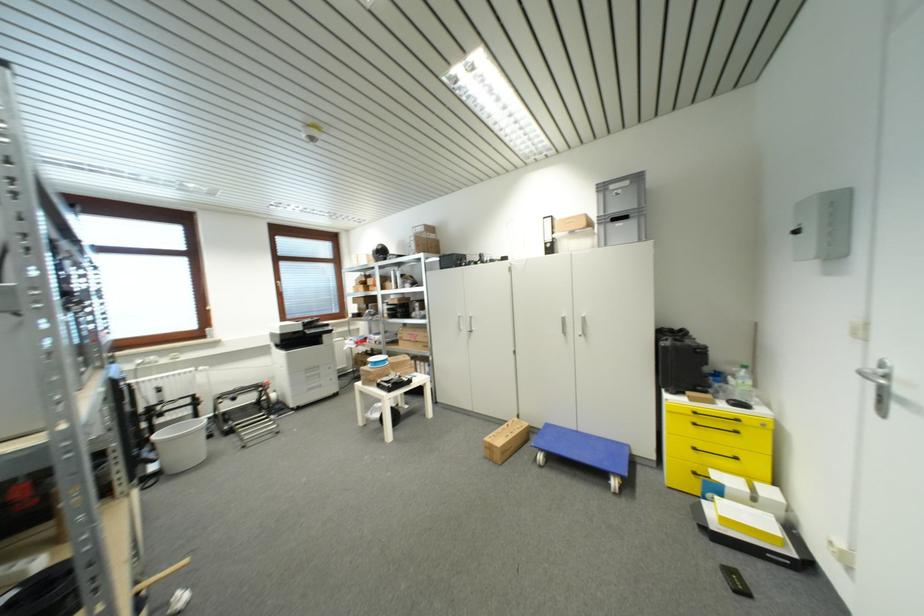
The location [681,362] corresponds to which object?

It refers to a black carrying case.